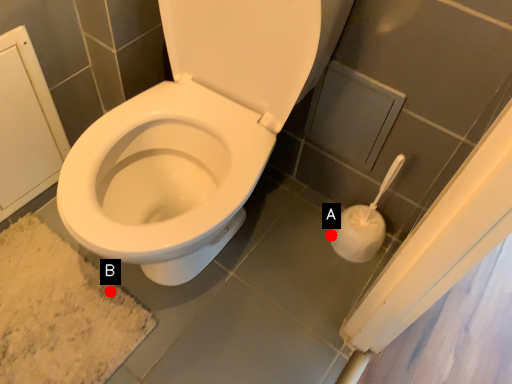
Question: Two points are circled on the image, labeled by A and B beside each circle. Which point appears closest to the camera in this image?

Choices:
 (A) A is closer
 (B) B is closer

Answer: (B)